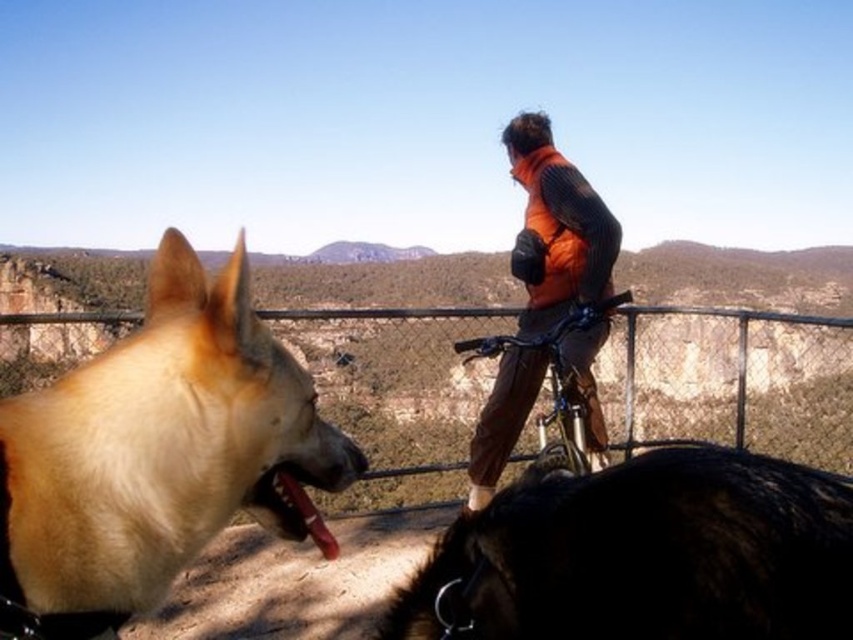
Question: Which point appears farthest from the camera in this image?

Choices:
 (A) (529, 403)
 (B) (846, 506)

Answer: (A)

Question: Which point is closer to the camera taking this photo?

Choices:
 (A) (306, 497)
 (B) (229, 440)
 (C) (453, 632)
 (D) (567, 294)

Answer: (C)

Question: Is golden fur dog at left closer to the viewer compared to brown glossy tongue at lower left?

Choices:
 (A) no
 (B) yes

Answer: (B)

Question: Does metal wire fence at center lie behind metallic silver bicycle at center?

Choices:
 (A) yes
 (B) no

Answer: (A)

Question: Does orange fleece vest at center have a lesser width compared to metallic silver bicycle at center?

Choices:
 (A) yes
 (B) no

Answer: (A)

Question: Which of the following is the closest to the observer?

Choices:
 (A) metal wire fence at center
 (B) orange fleece vest at center

Answer: (A)